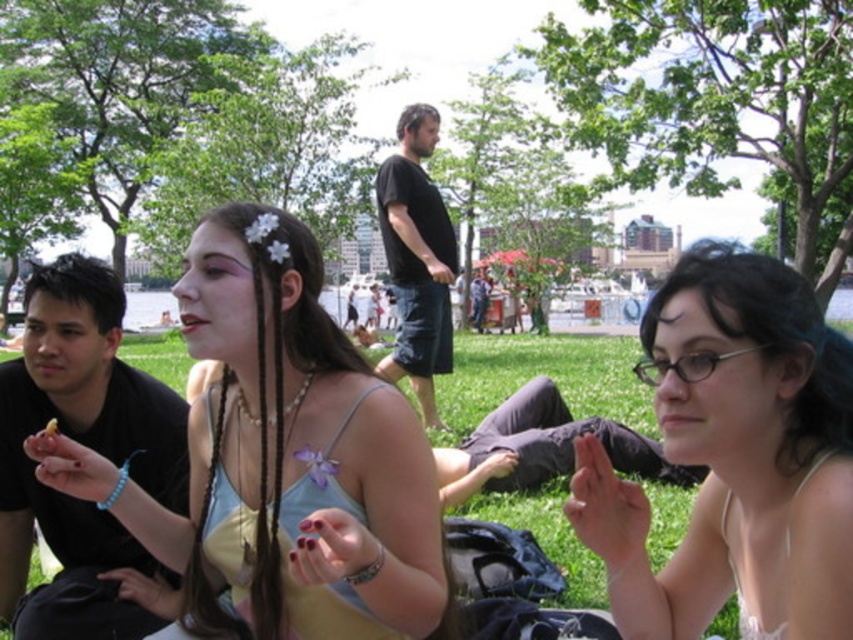
Question: Which point is farther to the camera?

Choices:
 (A) green grass at center
 (B) black cotton shirt at center
 (C) matte yellow tank top at center
 (D) black matte shirt at left

Answer: (B)

Question: Does white matte glasses at center have a larger size compared to black matte shirt at left?

Choices:
 (A) no
 (B) yes

Answer: (B)

Question: Which of the following is the closest to the observer?

Choices:
 (A) black matte shirt at left
 (B) black cotton shirt at center
 (C) white matte glasses at center

Answer: (C)

Question: Is matte yellow tank top at center to the left of green grass at center from the viewer's perspective?

Choices:
 (A) no
 (B) yes

Answer: (B)

Question: Which point is closer to the camera?

Choices:
 (A) green grass at center
 (B) black cotton shirt at center
 (C) matte yellow tank top at center

Answer: (C)

Question: Is matte yellow tank top at center wider than green grass at center?

Choices:
 (A) yes
 (B) no

Answer: (B)